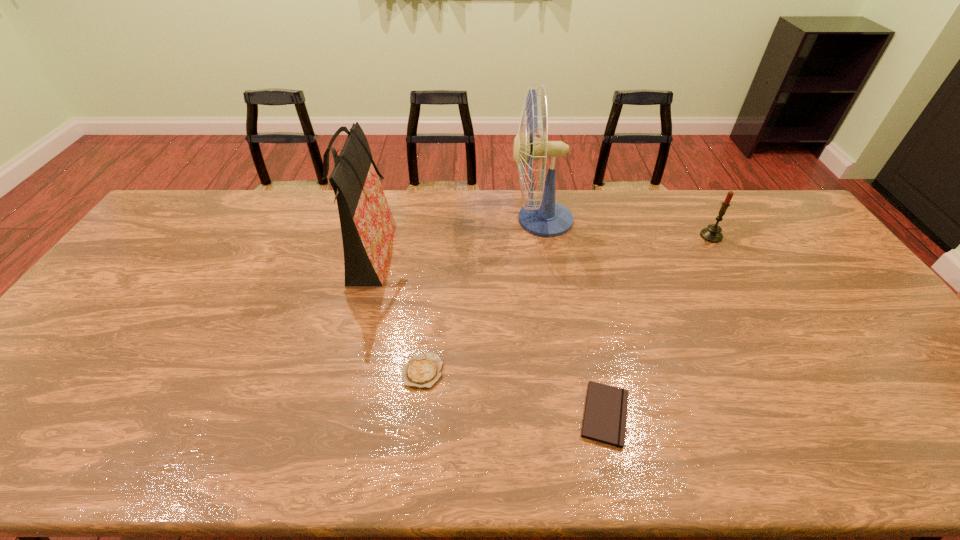
This screenshot has width=960, height=540. Identify the location of free point that satisfies the following two spatial constraints: 1. at the front of the fan where the blades are visible; 2. on the right side of the checkbook. (572, 414).